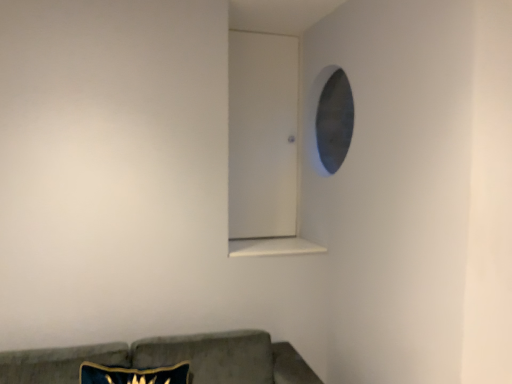
This screenshot has height=384, width=512. Describe the element at coordinates (272, 247) in the screenshot. I see `white smooth window sill at center` at that location.

What is the approximate width of white smooth window sill at center?

white smooth window sill at center is 41.46 centimeters in width.

The width and height of the screenshot is (512, 384). Identify the location of white smooth window sill at center. (272, 247).

Locate an element on the screen. The height and width of the screenshot is (384, 512). velvet green couch at lower left is located at coordinates (170, 359).

This screenshot has height=384, width=512. Describe the element at coordinates (170, 359) in the screenshot. I see `velvet green couch at lower left` at that location.

Measure the distance between velvet green couch at lower left and camera.

The depth of velvet green couch at lower left is 1.75 meters.

This screenshot has height=384, width=512. Identify the location of white smooth window sill at center. (272, 247).

Is white smooth window sill at center at the right side of velvet green couch at lower left?

Yes.

Which object is further away from the camera, white smooth window sill at center or velvet green couch at lower left?

white smooth window sill at center is behind.

Is point (259, 254) behind point (202, 348)?

Yes.

From the image's perspective, between white smooth window sill at center and velvet green couch at lower left, which one is located above?

From the image's view, white smooth window sill at center is above.

From a real-world perspective, is white smooth window sill at center positioned over velvet green couch at lower left based on gravity?

Yes, from a real-world perspective, white smooth window sill at center is on top of velvet green couch at lower left.

Does white smooth window sill at center have a lesser width compared to velvet green couch at lower left?

Yes.

Consider the image. Is white smooth window sill at center shorter than velvet green couch at lower left?

Yes.

Considering the sizes of objects white smooth window sill at center and velvet green couch at lower left in the image provided, who is bigger, white smooth window sill at center or velvet green couch at lower left?

velvet green couch at lower left.

Is white smooth window sill at center not within velvet green couch at lower left?

white smooth window sill at center lies outside velvet green couch at lower left's area.

Are white smooth window sill at center and velvet green couch at lower left making contact?

No.

Could you tell me if white smooth window sill at center is turned towards velvet green couch at lower left?

No, white smooth window sill at center is not turned towards velvet green couch at lower left.

How different are the orientations of white smooth window sill at center and velvet green couch at lower left in degrees?

They differ by 0.000924 degrees in their facing directions.

The image size is (512, 384). I want to click on studio couch below the white smooth window sill at center (from the image's perspective), so click(x=170, y=359).

Which is more to the left, velvet green couch at lower left or white smooth window sill at center?

From the viewer's perspective, velvet green couch at lower left appears more on the left side.

Which is in front, velvet green couch at lower left or white smooth window sill at center?

velvet green couch at lower left is more forward.

Looking at this image, which point is more distant from viewer, (205,340) or (258,246)?

Point (258,246)

Based on the photo, from the image's perspective, which one is positioned lower, velvet green couch at lower left or white smooth window sill at center?

From the image's view, velvet green couch at lower left is below.

From a real-world perspective, between velvet green couch at lower left and white smooth window sill at center, who is vertically lower?

In real-world perspective, velvet green couch at lower left is lower.

Which object is wider, velvet green couch at lower left or white smooth window sill at center?

With larger width is velvet green couch at lower left.

Looking at this image, between velvet green couch at lower left and white smooth window sill at center, which one has more height?

Standing taller between the two is velvet green couch at lower left.

Considering the relative sizes of velvet green couch at lower left and white smooth window sill at center in the image provided, is velvet green couch at lower left bigger than white smooth window sill at center?

Indeed, velvet green couch at lower left has a larger size compared to white smooth window sill at center.

Is white smooth window sill at center a part of velvet green couch at lower left?

No, white smooth window sill at center is located outside of velvet green couch at lower left.

Is velvet green couch at lower left not near white smooth window sill at center?

No, velvet green couch at lower left is not far from white smooth window sill at center.

Is velvet green couch at lower left positioned with its back to white smooth window sill at center?

No, white smooth window sill at center is not at the back of velvet green couch at lower left.

How different are the orientations of velvet green couch at lower left and white smooth window sill at center in degrees?

The facing directions of velvet green couch at lower left and white smooth window sill at center are 0.000924 degrees apart.

The height and width of the screenshot is (384, 512). I want to click on studio couch in front of the white smooth window sill at center, so click(170, 359).

In the image, there is a white smooth window sill at center. Identify the location of studio couch below it (from the image's perspective). This screenshot has width=512, height=384. (170, 359).

The width and height of the screenshot is (512, 384). What are the coordinates of `window sill behind the velvet green couch at lower left` in the screenshot? It's located at pyautogui.click(x=272, y=247).